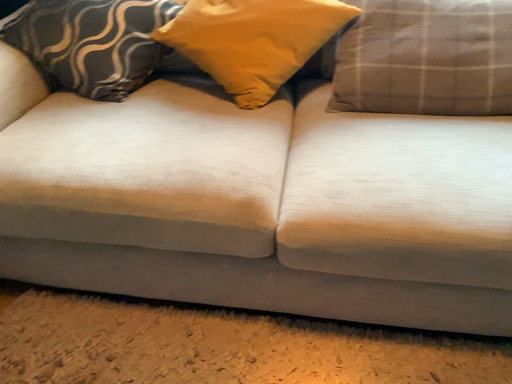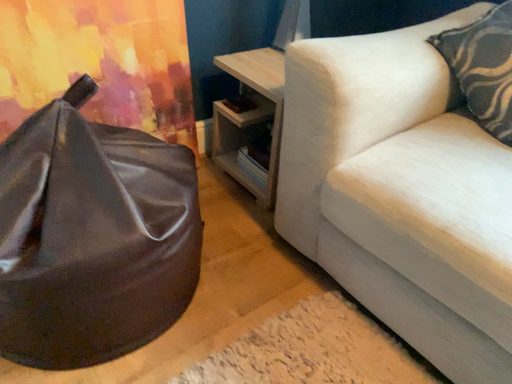
Question: Which way did the camera rotate in the video?

Choices:
 (A) rotated downward
 (B) rotated upward

Answer: (B)